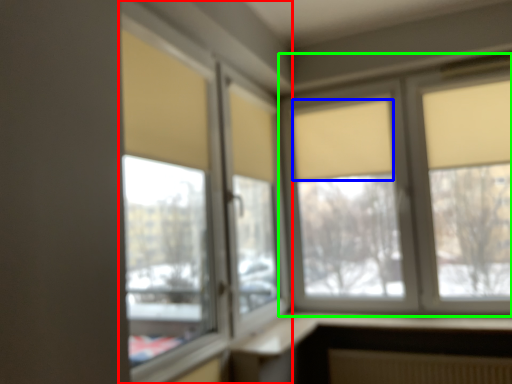
Question: Based on their relative distances, which object is nearer to window (highlighted by a red box)? Choose from curtain (highlighted by a blue box) and window (highlighted by a green box).

Choices:
 (A) curtain
 (B) window

Answer: (A)